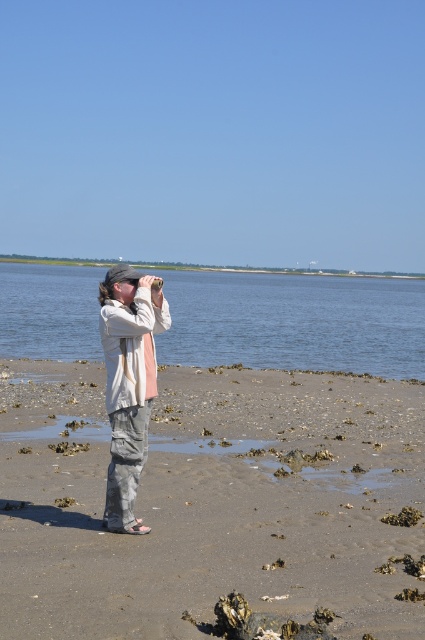
You are standing on the beach and see the blue water at center and the light gray cotton pants at center. Which object is positioned to the left?

The blue water at center is to the left of the light gray cotton pants at center.

You are a photographer trying to capture the brown sandy beach at center and the light gray cotton pants at center in a single frame. Which object should you focus on first if you want to ensure both are in focus?

The brown sandy beach at center is shorter than light gray cotton pants at center, so you should focus on the light gray cotton pants at center first to ensure both are within the depth of field.

You are standing on the beach and want to walk directly to the blue water at center. According to the coordinates provided, in which direction should you head from your current position?

The blue water at center is located at coordinates point (x=295, y=323). Since the y coordinate is 0.696, which is closer to 1.0, you should head downward towards the bottom of the image to reach the blue water at center.